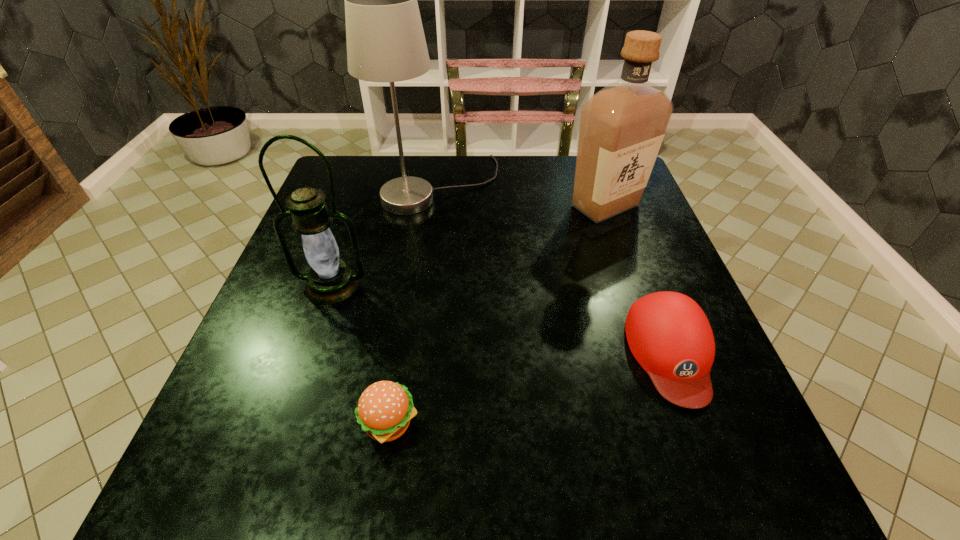
Locate an element on the screen. table lamp is located at coordinates (385, 39).

You are a GUI agent. You are given a task and a screenshot of the screen. Output one action in this format:
    pyautogui.click(x=<x>, y=<y>)
    Task: Click on the liquor
    This screenshot has height=540, width=960.
    Given the screenshot: What is the action you would take?
    pyautogui.click(x=622, y=126)

In order to click on lantern in this screenshot , I will do `click(329, 281)`.

At what (x,y) coordinates should I click in order to perform the action: click on the third farthest object. Please return your answer as a coordinate pair (x, y). The image size is (960, 540). Looking at the image, I should click on (329, 281).

This screenshot has height=540, width=960. In order to click on baseball cap in this screenshot , I will do point(669,335).

At what (x,y) coordinates should I click in order to perform the action: click on hamburger. Please return your answer as a coordinate pair (x, y). Image resolution: width=960 pixels, height=540 pixels. Looking at the image, I should click on (385, 408).

Find the location of `vacant space located 0.310m on the front of the table lamp`. vacant space located 0.310m on the front of the table lamp is located at coordinates (423, 315).

This screenshot has height=540, width=960. Identify the location of vacant space situated 0.060m on the front-facing side of the liquor. (618, 243).

Where is `free region located on the side where the third shortest object emits light`? free region located on the side where the third shortest object emits light is located at coordinates (284, 427).

At what (x,y) coordinates should I click in order to perform the action: click on free spot located on the front-facing side of the baseball cap. Please return your answer as a coordinate pair (x, y). Looking at the image, I should click on (707, 448).